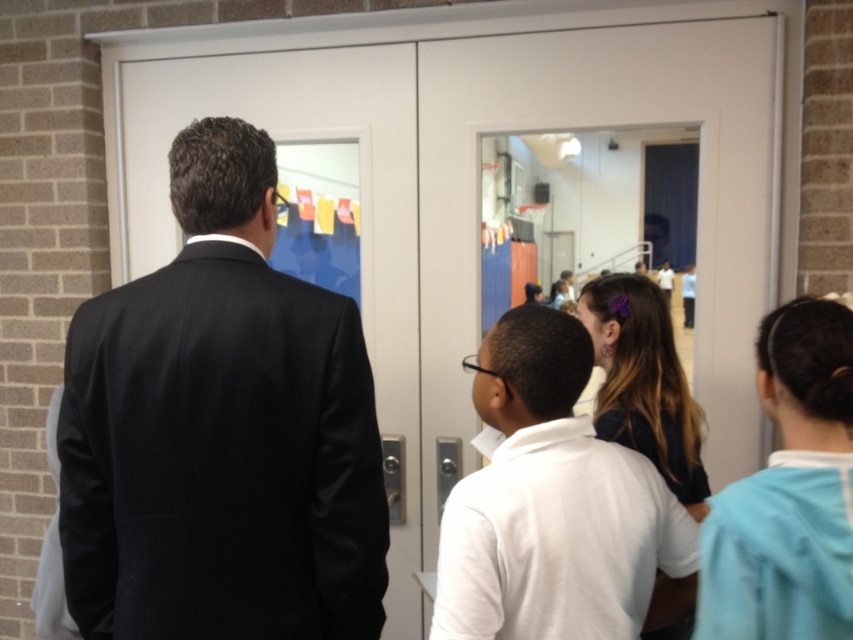
What are the coordinates of `white matte shirt at center` in the screenshot? It's located at (555, 506).

Who is positioned more to the left, white matte shirt at center or light blue fabric at right?

white matte shirt at center is more to the left.

Measure the distance between point (537, 321) and camera.

They are 4.17 feet apart.

You are a GUI agent. You are given a task and a screenshot of the screen. Output one action in this format:
    pyautogui.click(x=<x>, y=<y>)
    Task: Click on the white matte shirt at center
    This screenshot has width=853, height=640.
    Given the screenshot: What is the action you would take?
    pyautogui.click(x=555, y=506)

Is light blue fabric at right above dark brown hair at center?

Indeed, light blue fabric at right is positioned over dark brown hair at center.

Does light blue fabric at right have a lesser height compared to dark brown hair at center?

Yes.

Between point (801, 413) and point (666, 422), which one is positioned in front?

Positioned in front is point (801, 413).

Find the location of a particular element. The height and width of the screenshot is (640, 853). light blue fabric at right is located at coordinates (788, 492).

Between white matte shirt at center and dark brown hair at center, which one is positioned higher?

dark brown hair at center is above.

Is white matte shirt at center smaller than dark brown hair at center?

Actually, white matte shirt at center might be larger than dark brown hair at center.

Does point (474, 579) come farther from viewer compared to point (665, 477)?

No, it is in front of (665, 477).

The height and width of the screenshot is (640, 853). Find the location of `white matte shirt at center`. white matte shirt at center is located at coordinates (555, 506).